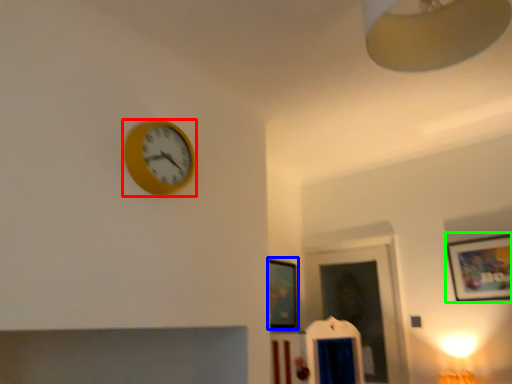
Question: Estimate the real-world distances between objects in this image. Which object is closer to wall clock (highlighted by a red box), picture frame (highlighted by a blue box) or picture frame (highlighted by a green box)?

Choices:
 (A) picture frame
 (B) picture frame

Answer: (A)